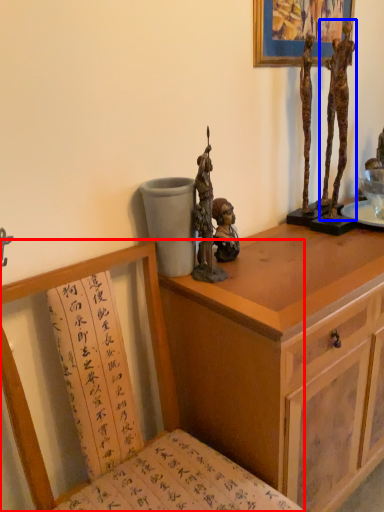
Question: Which object is closer to the camera taking this photo, chair (highlighted by a red box) or person (highlighted by a blue box)?

Choices:
 (A) chair
 (B) person

Answer: (A)